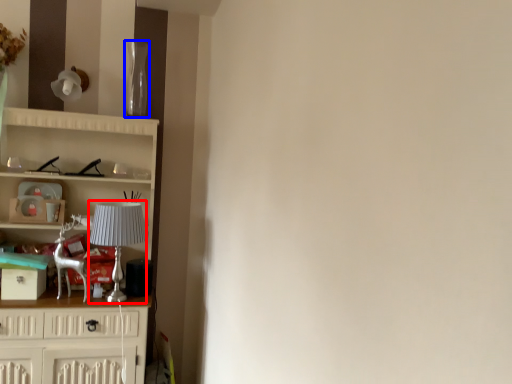
Question: Which object appears closest to the camera in this image, lamp (highlighted by a red box) or glass vase (highlighted by a blue box)?

Choices:
 (A) lamp
 (B) glass vase

Answer: (A)